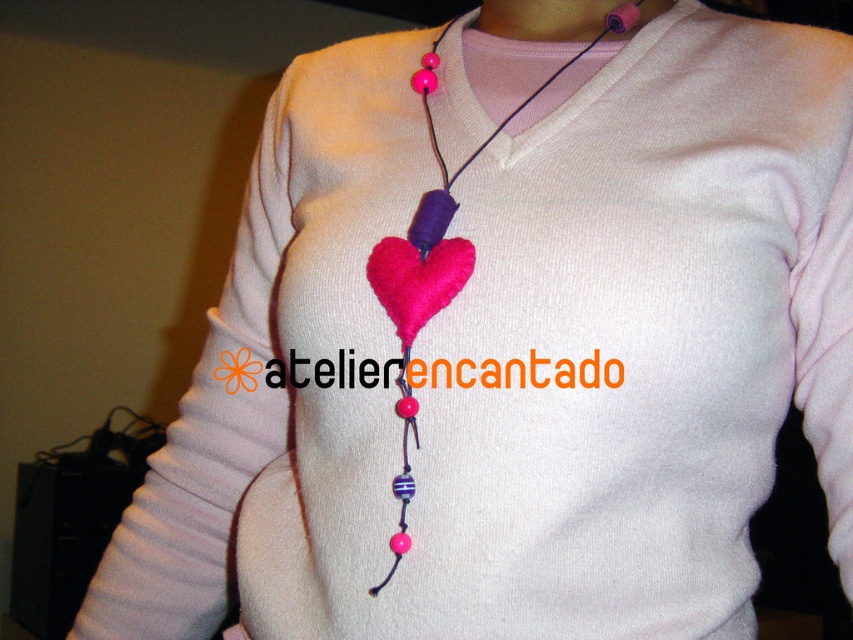
Question: Which object is closer to the camera taking this photo?

Choices:
 (A) pink matte necklace at upper center
 (B) purple felt heart at center
 (C) felt heart at center
 (D) fuzzy pink heart at center

Answer: (C)

Question: Can you confirm if felt heart at center is smaller than pink matte necklace at upper center?

Choices:
 (A) no
 (B) yes

Answer: (A)

Question: Among these objects, which one is nearest to the camera?

Choices:
 (A) fuzzy pink heart at center
 (B) purple felt heart at center
 (C) felt heart at center

Answer: (C)

Question: In this image, where is felt heart at center located relative to purple felt heart at center?

Choices:
 (A) left
 (B) right

Answer: (A)

Question: In this image, where is fuzzy pink heart at center located relative to purple felt heart at center?

Choices:
 (A) right
 (B) left

Answer: (B)

Question: Estimate the real-world distances between objects in this image. Which object is closer to the purple felt heart at center?

Choices:
 (A) pink matte necklace at upper center
 (B) felt heart at center

Answer: (A)